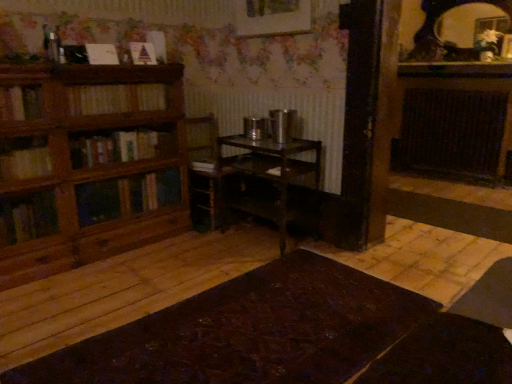
At what (x,y) coordinates should I click in order to perform the action: click on free area in between metallic dark brown table at center, placed as the 1th table when sorted from top to bottom, and dark brown wooden table at center, positioned as the first table in bottom-to-top order. Please return your answer as a coordinate pair (x, y). The image size is (512, 384). Looking at the image, I should click on (231, 266).